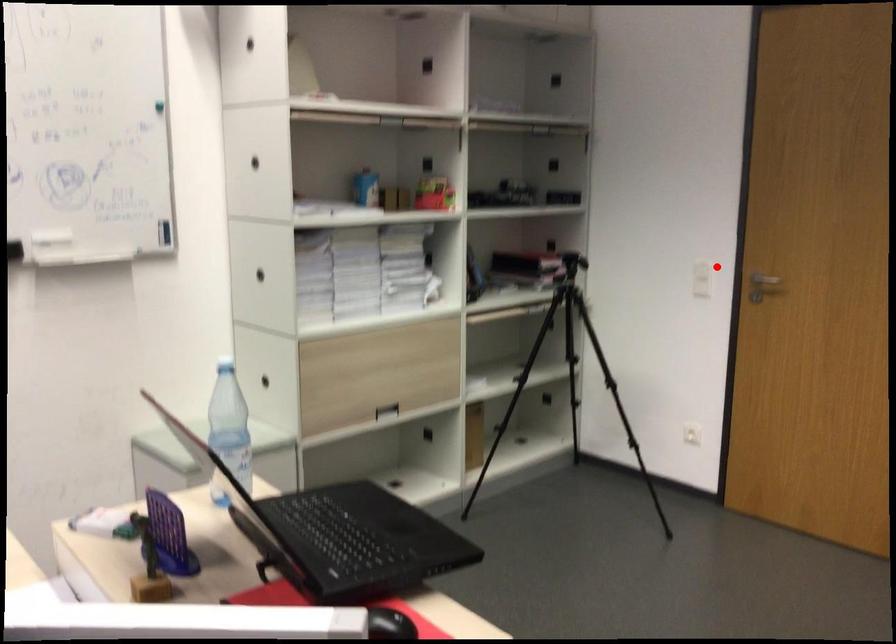
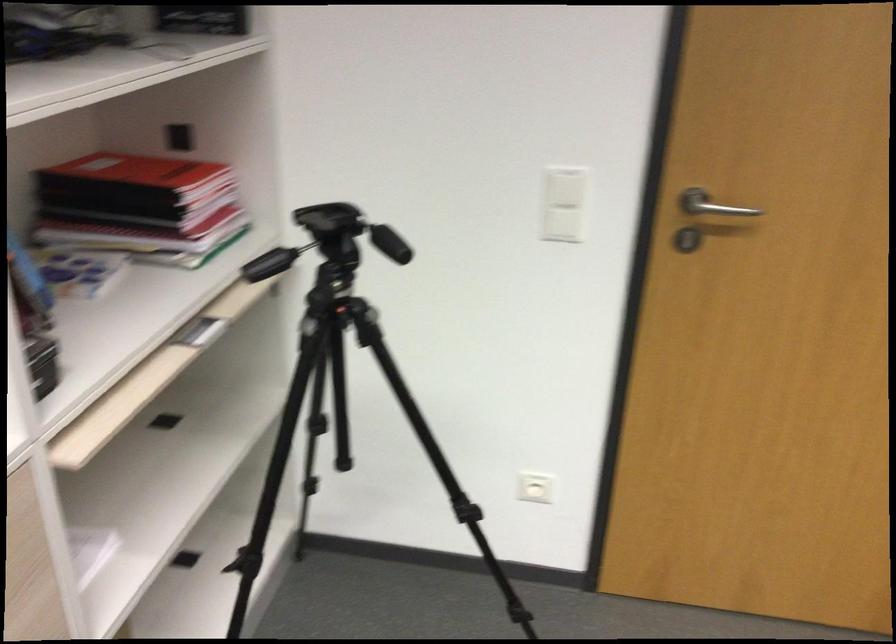
In the second image, find the point that corresponds to the highlighted location in the first image.

(565, 187)